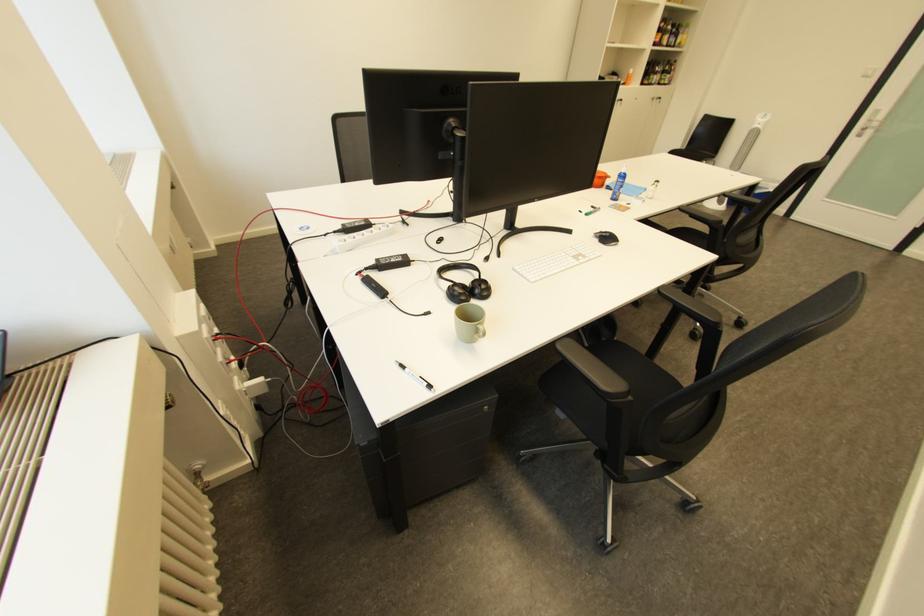
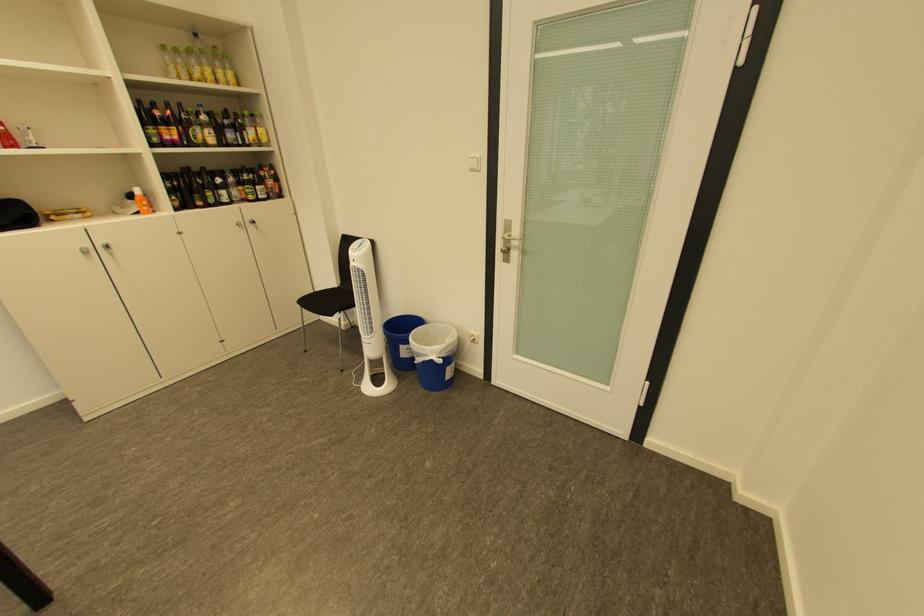
Where in the second image is the point corresponding to pixel 770 188 from the first image?

(429, 355)